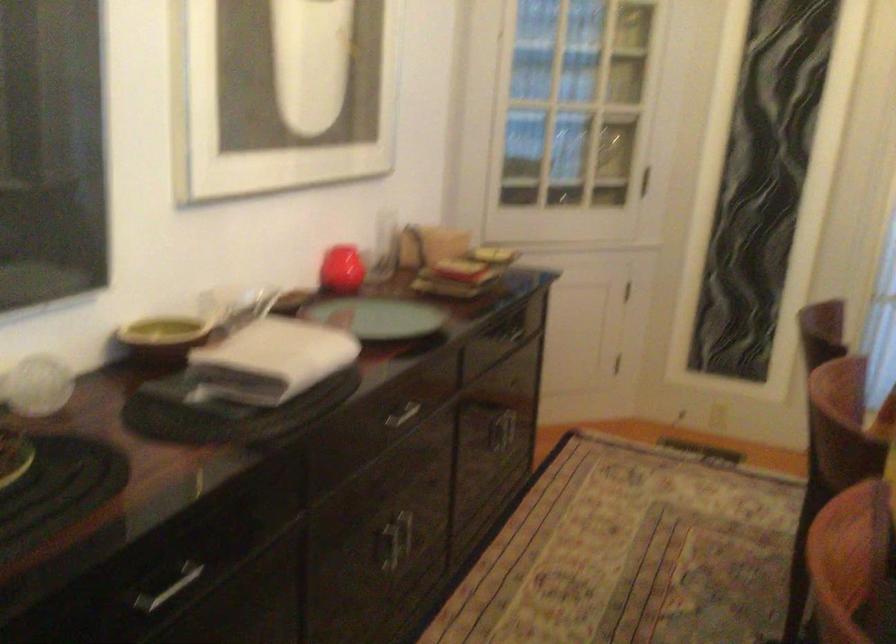
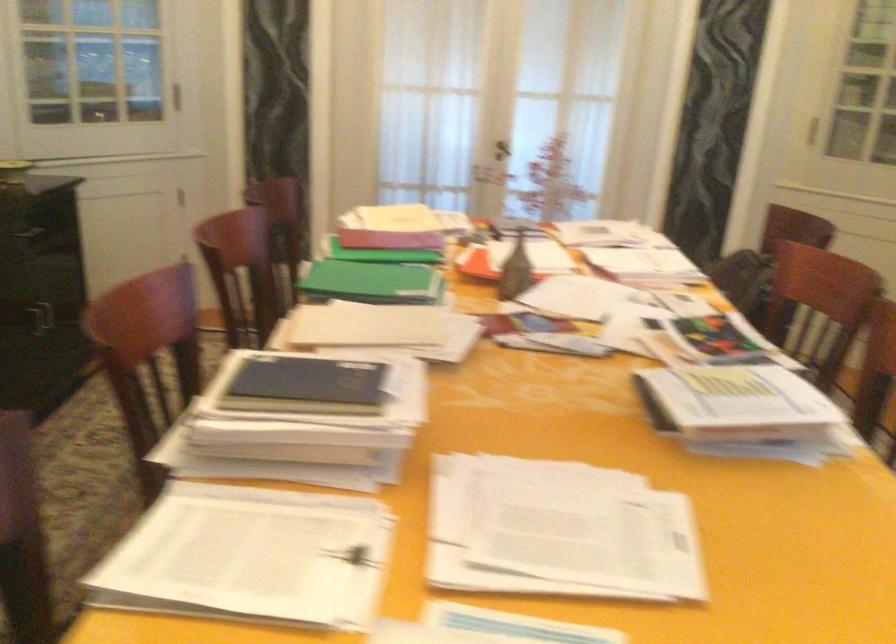
The images are taken continuously from a first-person perspective. In which direction are you moving?

The cameraman walked toward right, backward.